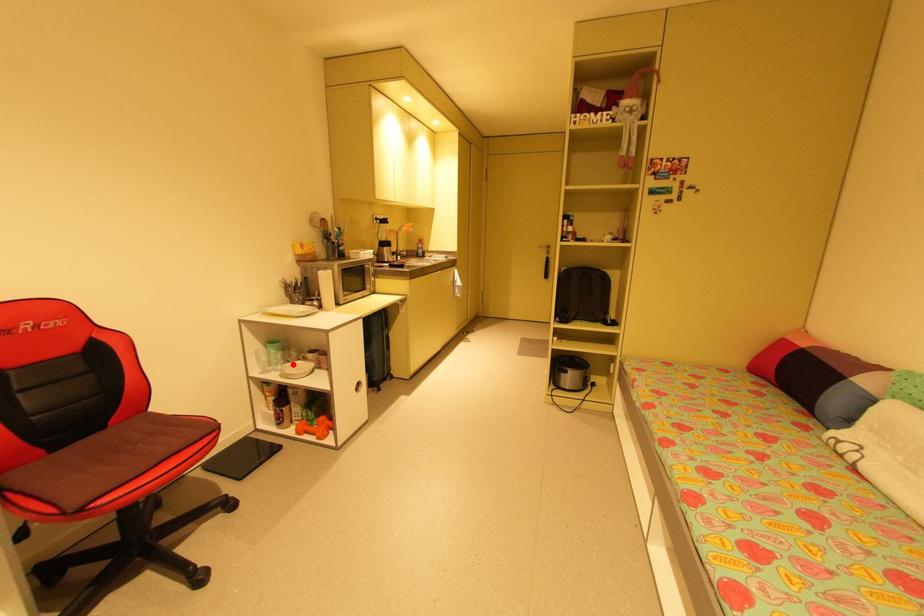
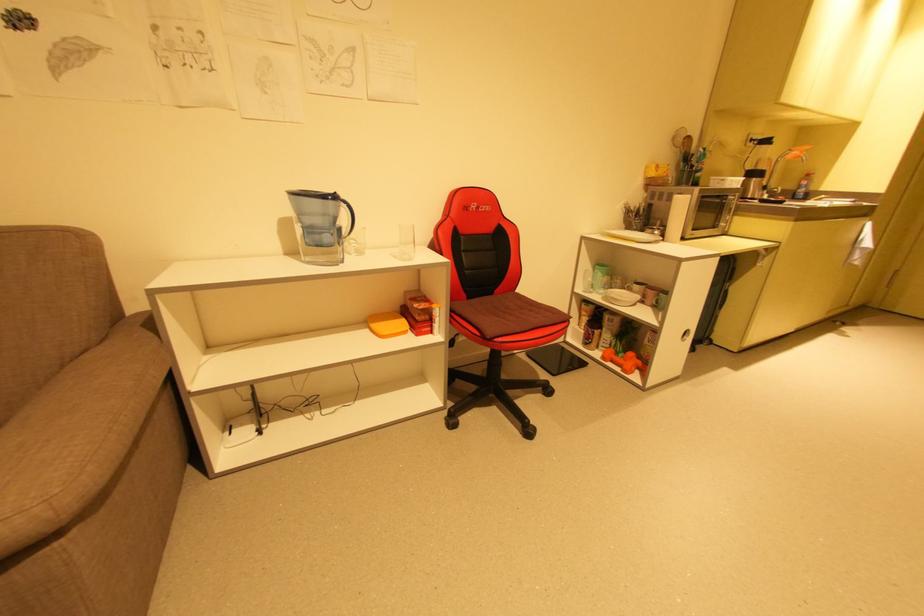
In the second image, find the point that corresponds to the highlighted location in the first image.

(616, 290)